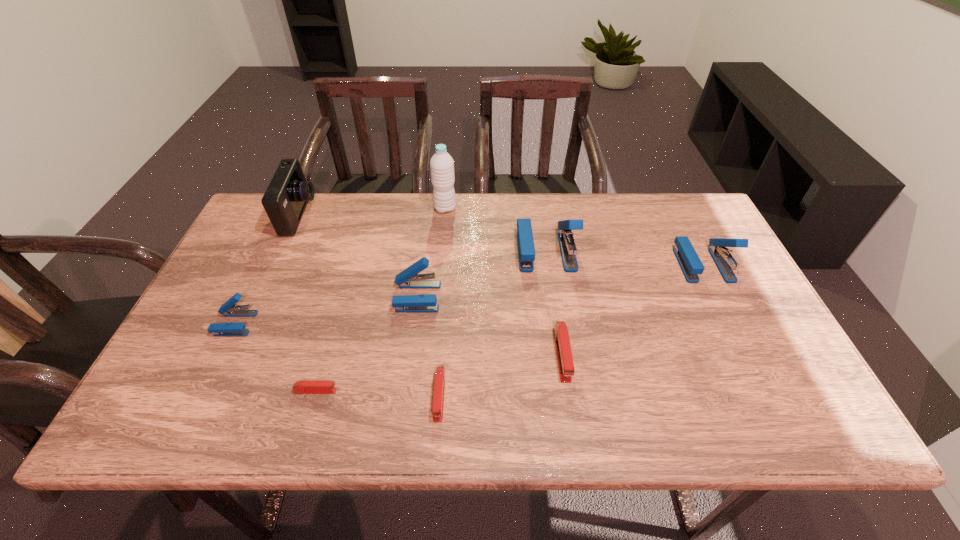
Where is `free space located on the front of the rightmost stapler`? Image resolution: width=960 pixels, height=540 pixels. free space located on the front of the rightmost stapler is located at coordinates (759, 378).

Image resolution: width=960 pixels, height=540 pixels. I want to click on vacant space located on the front of the third biggest blue stapler, so click(x=409, y=356).

Image resolution: width=960 pixels, height=540 pixels. I want to click on vacant point located 0.200m on the right of the leftmost blue stapler, so click(334, 323).

Locate an element on the screen. free space located on the front-facing side of the fifth tallest stapler is located at coordinates (570, 408).

Find the location of a particular element. Image resolution: width=960 pixels, height=540 pixels. blank area located 0.060m on the front-facing side of the second stapler from left to right is located at coordinates (364, 391).

At what (x,y) coordinates should I click in order to perform the action: click on water bottle present at the far edge. Please return your answer as a coordinate pair (x, y). This screenshot has width=960, height=540. Looking at the image, I should click on (441, 164).

You are a GUI agent. You are given a task and a screenshot of the screen. Output one action in this format:
    pyautogui.click(x=<x>, y=<y>)
    Task: Click on the camera located in the far edge section of the desktop
    
    Given the screenshot: What is the action you would take?
    pyautogui.click(x=285, y=199)

This screenshot has width=960, height=540. What are the coordinates of `stapler at the far edge` in the screenshot? It's located at (526, 251).

Image resolution: width=960 pixels, height=540 pixels. Find the location of `object situated at the near edge`. object situated at the near edge is located at coordinates (439, 383).

Locate an element on the screen. camera present at the left edge is located at coordinates (285, 199).